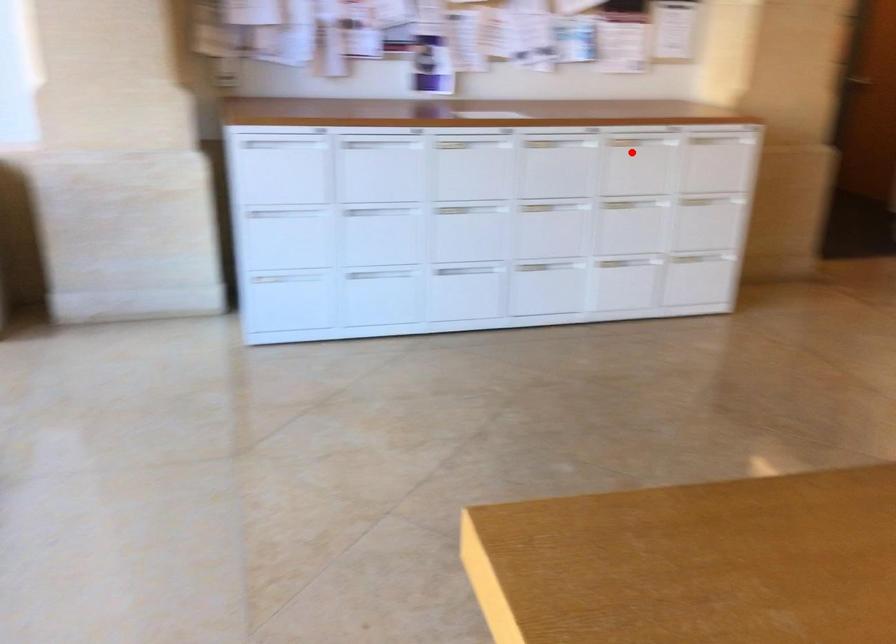
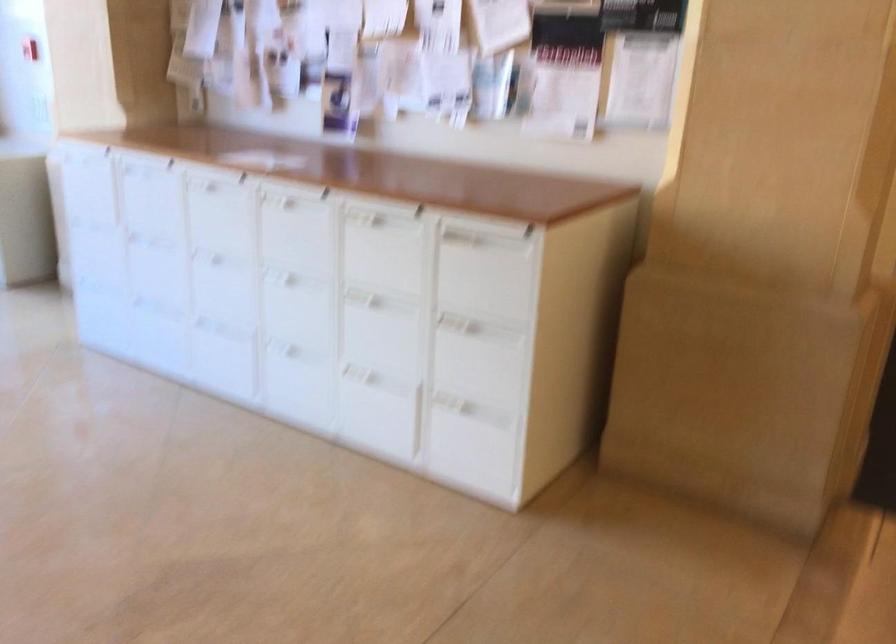
Find the pixel in the second image that matches the highlighted location in the first image.

(382, 247)